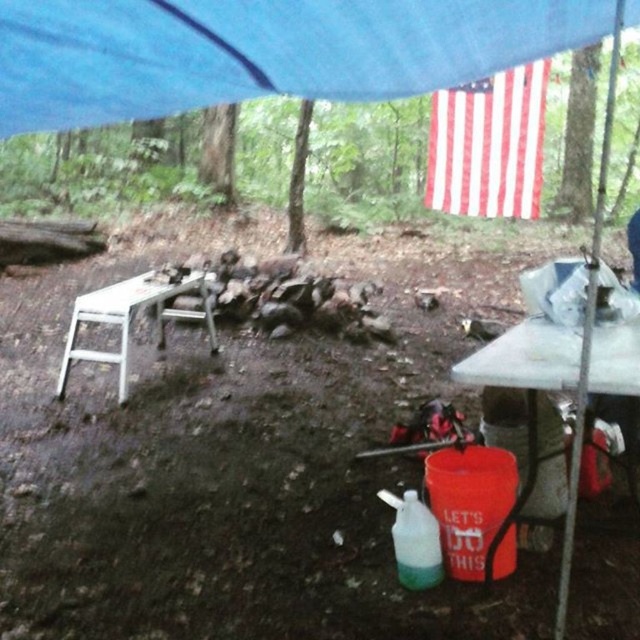
You are setting up a picnic at the campsite and have a red and white striped fabric at upper right and an orange plastic bucket at lower right. Which object is larger in size?

The red and white striped fabric at upper right is bigger than the orange plastic bucket at lower right.

You are setting up a picnic area at the campsite. You have a picnic basket that needs to be placed on the largest available surface. Which object between the red and white striped fabric at upper right and the white metallic table at left should you choose?

The red and white striped fabric at upper right is bigger than the white metallic table at left, so you should place the picnic basket on the red and white striped fabric at upper right.